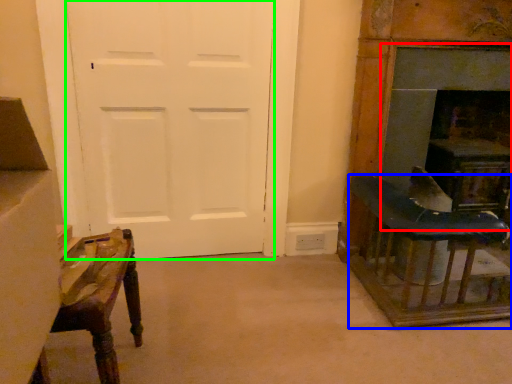
Question: Which object is positioned farthest from fireplace (highlighted by a red box)? Select from table (highlighted by a blue box) and screen door (highlighted by a green box).

Choices:
 (A) table
 (B) screen door

Answer: (B)